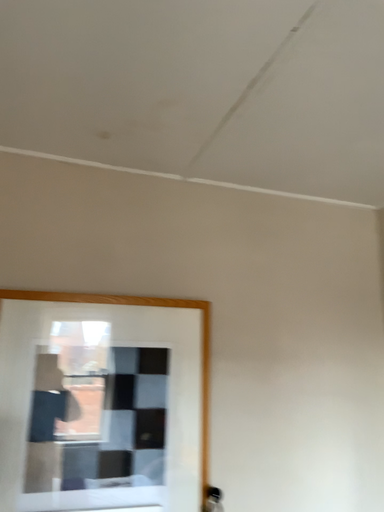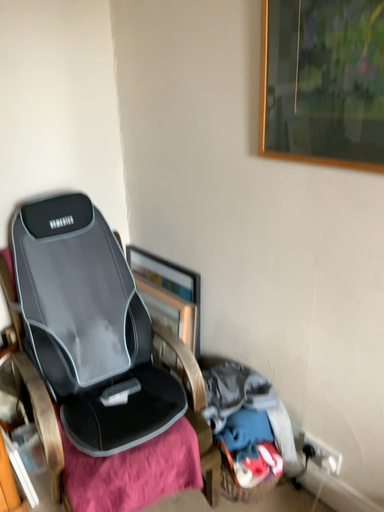
Question: How did the camera likely rotate when shooting the video?

Choices:
 (A) rotated downward
 (B) rotated upward

Answer: (A)